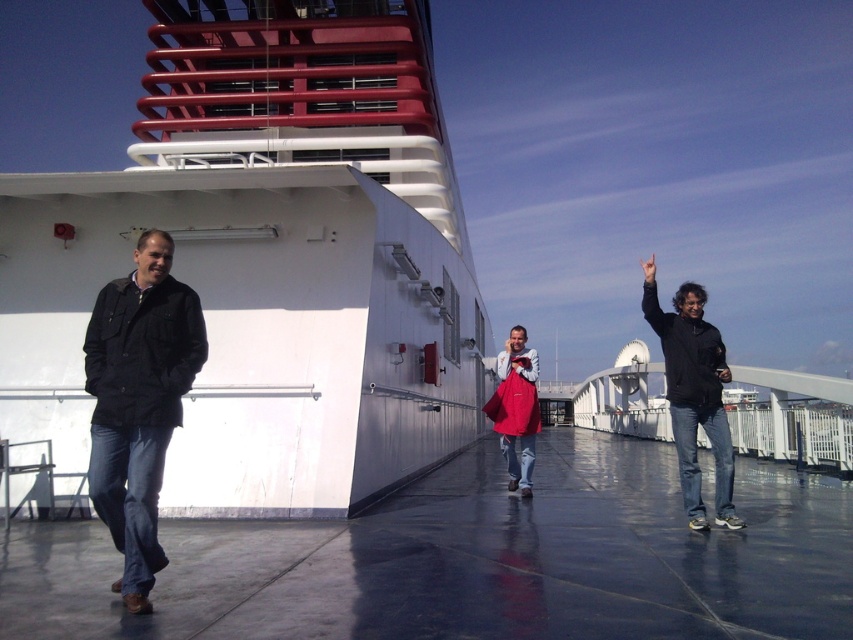
Who is higher up, black matte jacket at right or matte red bag at center?

Positioned higher is black matte jacket at right.

Between black matte jacket at right and matte red bag at center, which one has more height?

With more height is black matte jacket at right.

You are a GUI agent. You are given a task and a screenshot of the screen. Output one action in this format:
    pyautogui.click(x=<x>, y=<y>)
    Task: Click on the black matte jacket at right
    The image size is (853, 640).
    Given the screenshot: What is the action you would take?
    pyautogui.click(x=693, y=394)

Does glossy rubber deck at center lie behind matte red bag at center?

No, it is not.

The width and height of the screenshot is (853, 640). What do you see at coordinates (473, 561) in the screenshot?
I see `glossy rubber deck at center` at bounding box center [473, 561].

In order to click on glossy rubber deck at center in this screenshot , I will do `click(473, 561)`.

Does glossy rubber deck at center have a lesser width compared to black matte jacket at left?

In fact, glossy rubber deck at center might be wider than black matte jacket at left.

Does glossy rubber deck at center have a lesser height compared to black matte jacket at left?

Correct, glossy rubber deck at center is not as tall as black matte jacket at left.

Which is in front, point (531, 529) or point (166, 296)?

Point (166, 296) is in front.

The width and height of the screenshot is (853, 640). I want to click on glossy rubber deck at center, so click(x=473, y=561).